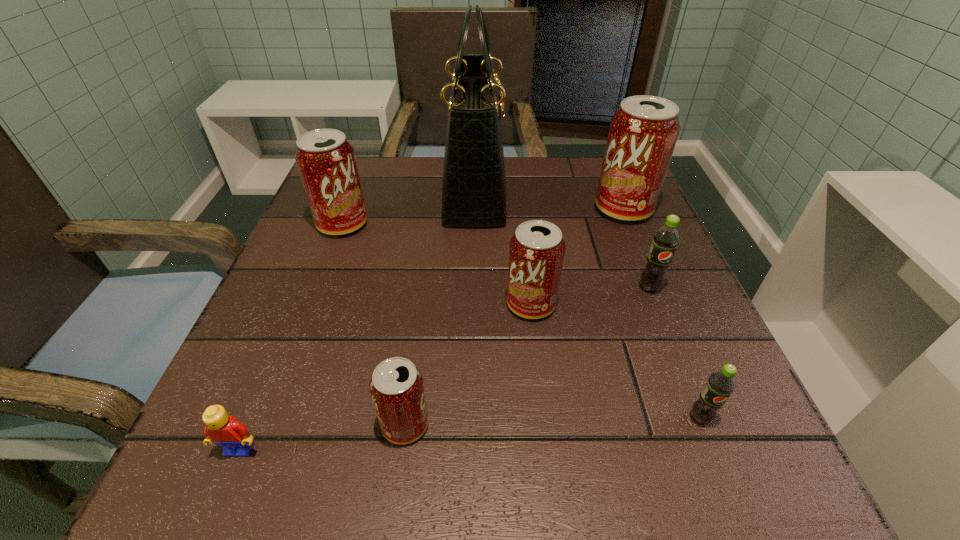
Find the location of a particular element. free location that satisfies the following two spatial constraints: 1. at the front of the handbag with visible charms; 2. on the right side of the biggest red soda can is located at coordinates (474, 209).